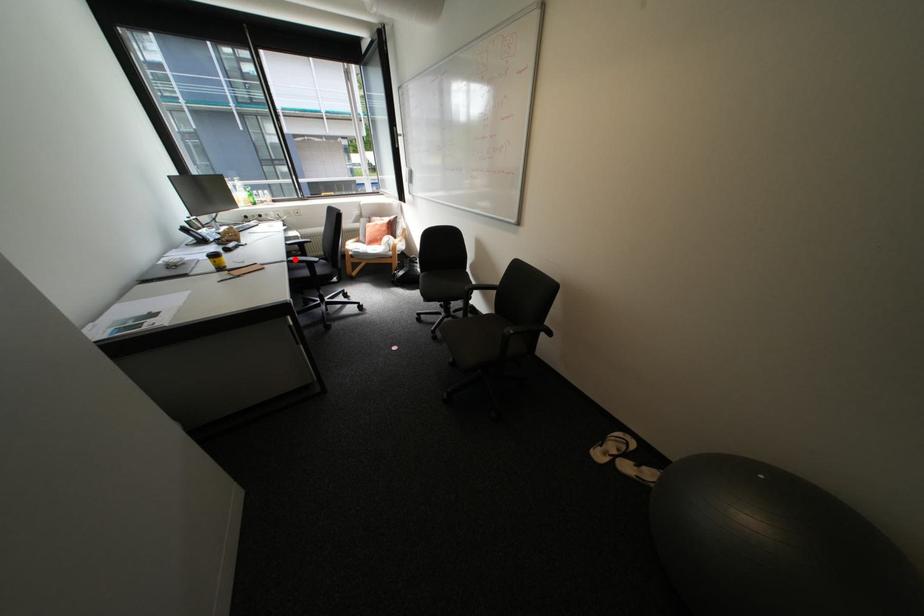
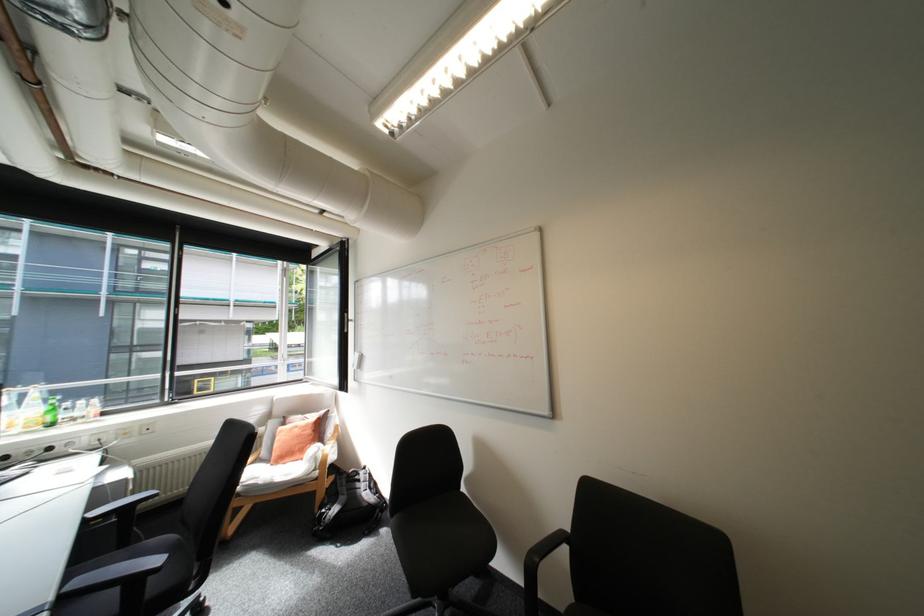
Question: I am providing you with two images of the same scene from different viewpoints. Given a red point in image1, look at the same physical point in image2. Is it:

Choices:
 (A) Closer to the viewpoint
 (B) Farther from the viewpoint

Answer: (B)